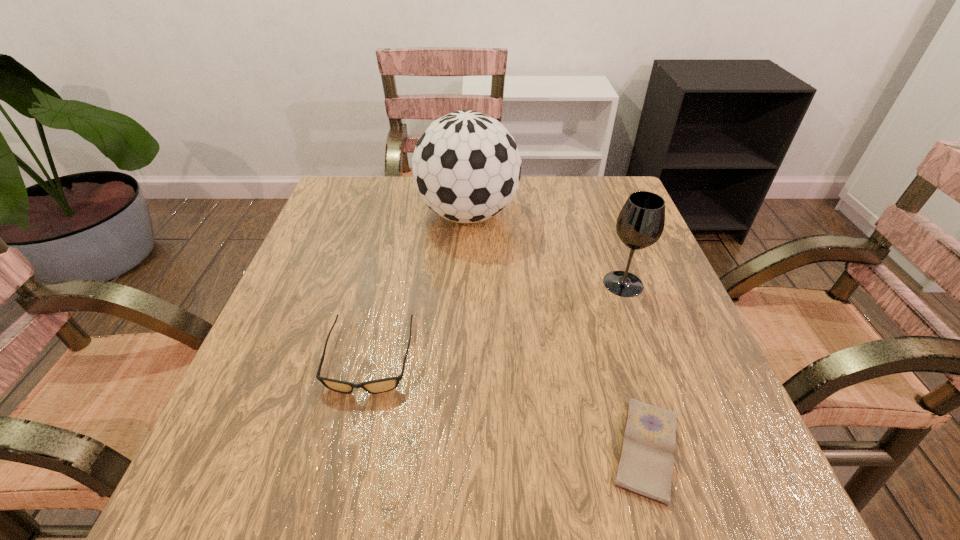
At what (x,y) coordinates should I click in order to perform the action: click on soccer ball. Please return your answer as a coordinate pair (x, y). Looking at the image, I should click on (466, 166).

Locate an element on the screen. Image resolution: width=960 pixels, height=540 pixels. the farthest object is located at coordinates (466, 166).

Locate an element on the screen. the second farthest object is located at coordinates (640, 223).

You are a GUI agent. You are given a task and a screenshot of the screen. Output one action in this format:
    pyautogui.click(x=<x>, y=<y>)
    Task: Click on the second tallest object
    The width and height of the screenshot is (960, 540).
    Given the screenshot: What is the action you would take?
    pyautogui.click(x=640, y=223)

Image resolution: width=960 pixels, height=540 pixels. Identify the location of the third farthest object. 387,384.

Where is `the third tallest object`? Image resolution: width=960 pixels, height=540 pixels. the third tallest object is located at coordinates (387, 384).

Where is `diary`? This screenshot has height=540, width=960. diary is located at coordinates (645, 468).

At what (x,y) coordinates should I click in order to perform the action: click on the shortest object. Please return your answer as a coordinate pair (x, y). The height and width of the screenshot is (540, 960). Looking at the image, I should click on (x=645, y=468).

Identify the location of vacant space located 0.260m on the right of the farthest object. (621, 214).

At what (x,y) coordinates should I click in order to perform the action: click on free location located 0.300m on the front of the second tallest object. Please return your answer as a coordinate pair (x, y). This screenshot has width=960, height=540. Looking at the image, I should click on (678, 437).